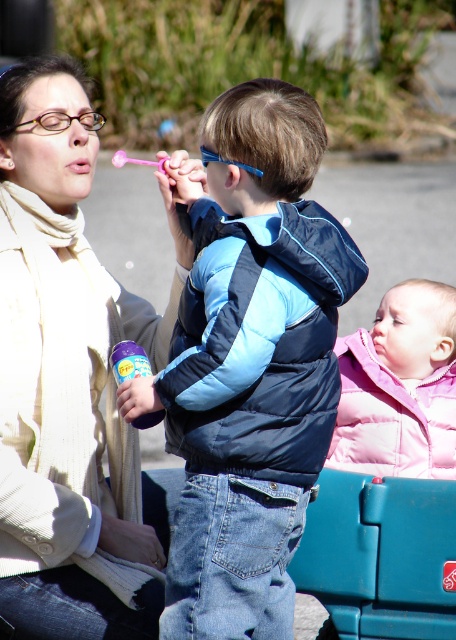
The width and height of the screenshot is (456, 640). In order to click on blue down jacket at center in this screenshot , I will do `click(249, 364)`.

In the scene shown: Is blue down jacket at center below matte beige scarf at upper left?

Yes.

Where is `blue down jacket at center`? This screenshot has height=640, width=456. blue down jacket at center is located at coordinates (249, 364).

Which of these two, blue down jacket at center or pink puffy jacket at lower right, stands shorter?

pink puffy jacket at lower right is shorter.

Measure the distance between blue down jacket at center and camera.

blue down jacket at center is 4.44 meters away from camera.

Identify the location of blue down jacket at center. The width and height of the screenshot is (456, 640). (249, 364).

Does matte beige scarf at upper left have a lesser height compared to blue synthetic puffer jacket at center?

Incorrect, matte beige scarf at upper left's height does not fall short of blue synthetic puffer jacket at center's.

Locate an element on the screen. matte beige scarf at upper left is located at coordinates (67, 376).

Between point (105, 497) and point (233, 234), which one is positioned in front?

Positioned in front is point (233, 234).

You are a GUI agent. You are given a task and a screenshot of the screen. Output one action in this format:
    pyautogui.click(x=<x>, y=<y>)
    Task: Click on the matte beige scarf at upper left
    The height and width of the screenshot is (640, 456).
    Given the screenshot: What is the action you would take?
    pyautogui.click(x=67, y=376)